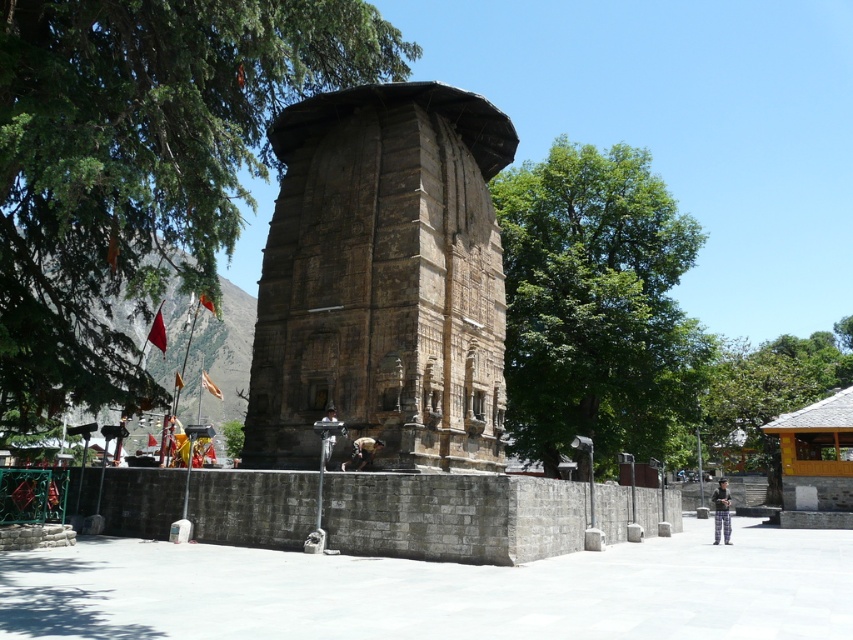
Question: Which of these objects is positioned farthest from the green leafy tree at upper left?

Choices:
 (A) green leafy tree at center
 (B) dark brown leather jacket at center

Answer: (A)

Question: Does green leafy tree at upper left appear on the right side of dark brown leather jacket at center?

Choices:
 (A) yes
 (B) no

Answer: (B)

Question: Is green leafy tree at upper left further to camera compared to dark gray stone statue at center?

Choices:
 (A) yes
 (B) no

Answer: (B)

Question: Which of the following is the farthest from the observer?

Choices:
 (A) (289, 305)
 (B) (164, 196)
 (C) (824, 362)

Answer: (C)

Question: Can you confirm if brown stone monument at center is wider than green leafy tree at center?

Choices:
 (A) yes
 (B) no

Answer: (B)

Question: Based on their relative distances, which object is farther from the brown stone monument at center?

Choices:
 (A) green leafy tree at upper left
 (B) green leafy tree at right
 (C) plaid pants at lower right

Answer: (B)